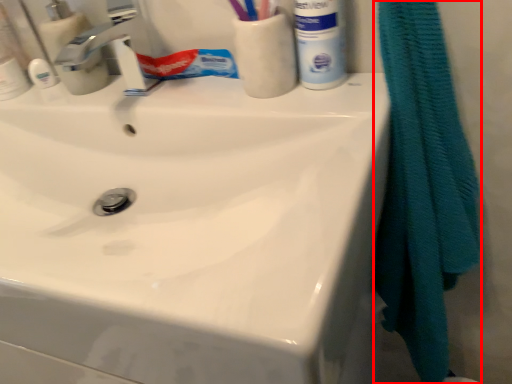
Question: Where is bath towel (annotated by the red box) located in relation to mouthwash in the image?

Choices:
 (A) right
 (B) left

Answer: (A)